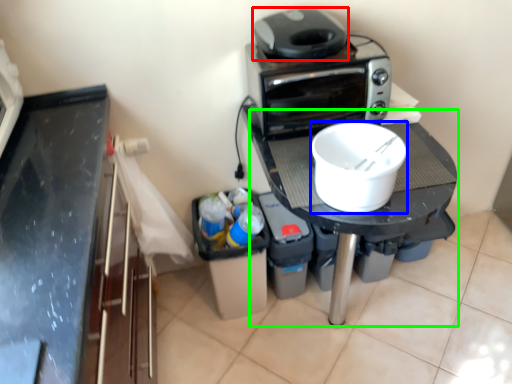
Question: Which object is positioned closest to home appliance (highlighted by a red box)? Select from kitchen appliance (highlighted by a blue box) and table (highlighted by a green box).

Choices:
 (A) kitchen appliance
 (B) table

Answer: (A)